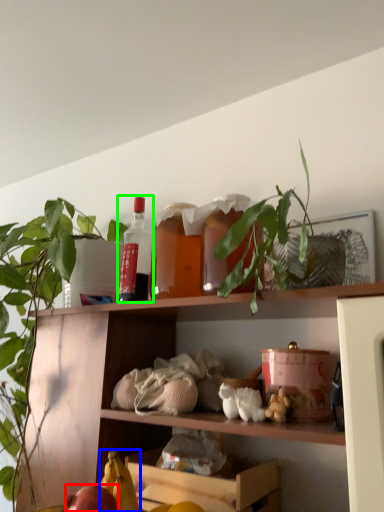
Question: Which object is the closest to the apple (highlighted by a red box)? Choose among these: banana (highlighted by a blue box) or bottle (highlighted by a green box).

Choices:
 (A) banana
 (B) bottle

Answer: (A)